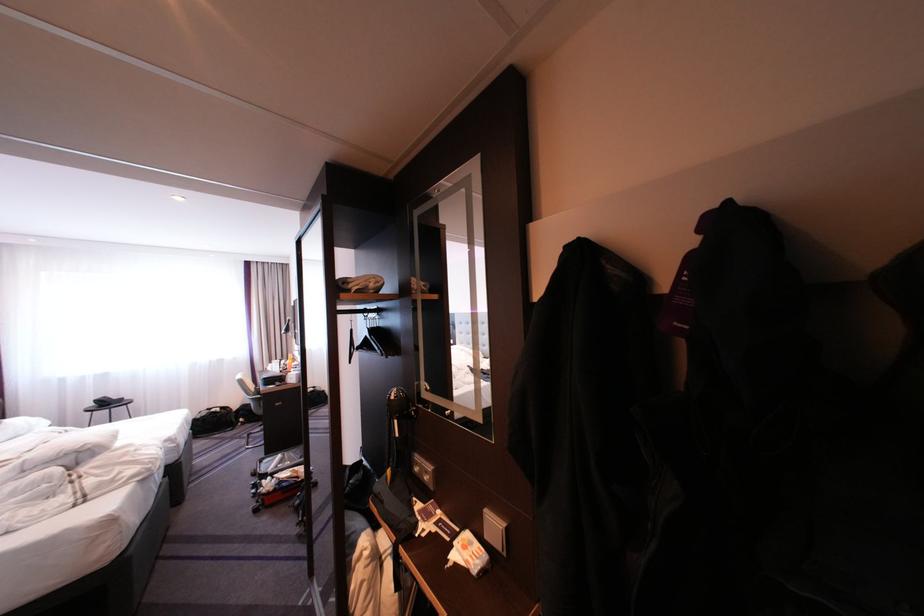
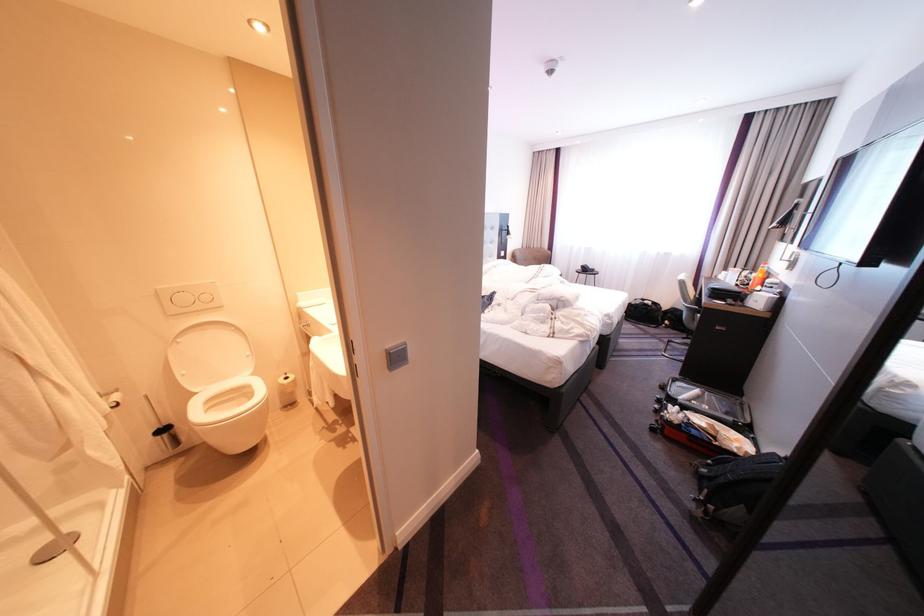
The images are taken continuously from a first-person perspective. In which direction is your viewpoint rotating?

The rotation direction of the camera is left-down.